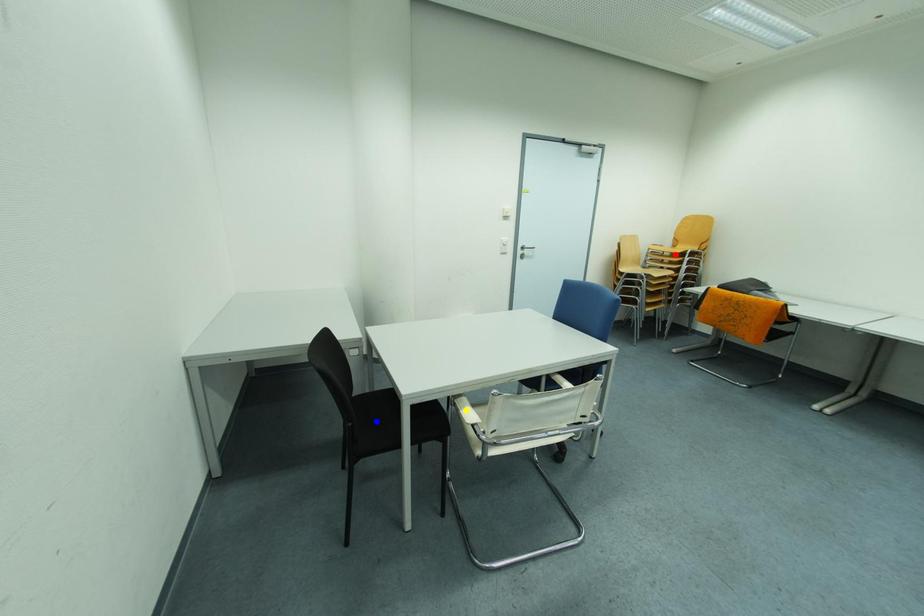
From the picture: Order these from farthest to nearest:
- red point
- yellow point
- blue point

1. red point
2. yellow point
3. blue point